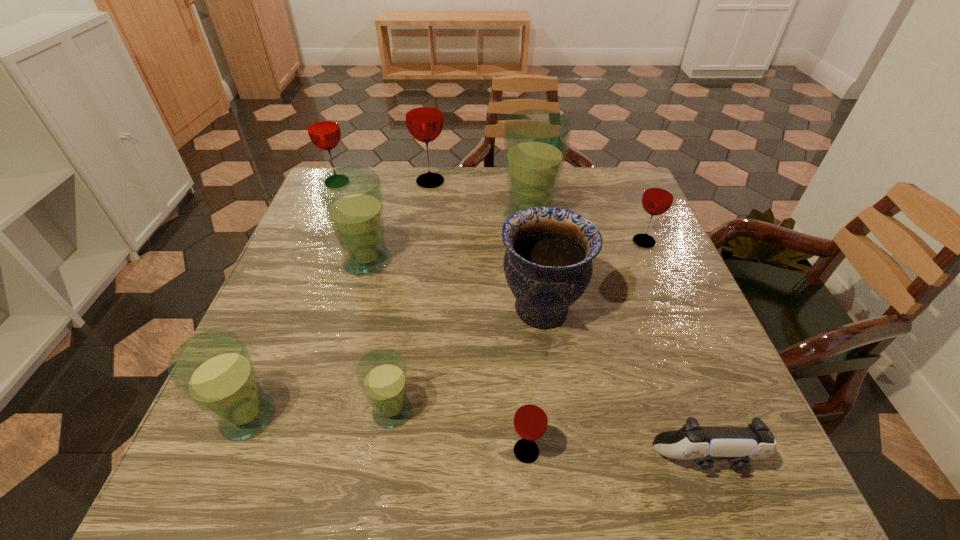
Identify the location of the second closest red glass to the third blue glass from left to right. (658, 196).

This screenshot has height=540, width=960. Identify the location of red glass that is the fourth closest one to the third blue glass from left to right. (323, 128).

In order to click on the closest blue glass to the third glass from left to right in this screenshot , I will do `click(536, 141)`.

Where is `blue glass that is the second nearest to the smallest red glass`? This screenshot has width=960, height=540. blue glass that is the second nearest to the smallest red glass is located at coordinates (214, 369).

At what (x,y) coordinates should I click in order to perform the action: click on vacant region that satisfies the following two spatial constraints: 1. on the back side of the smallest blue glass; 2. on the left side of the second smallest blue glass. Please return your answer as a coordinate pair (x, y). The width and height of the screenshot is (960, 540). Looking at the image, I should click on (x=251, y=411).

Find the location of a particular element. vacant area in the image that satisfies the following two spatial constraints: 1. on the front side of the rightmost blue glass; 2. on the left side of the biggest red glass is located at coordinates (425, 217).